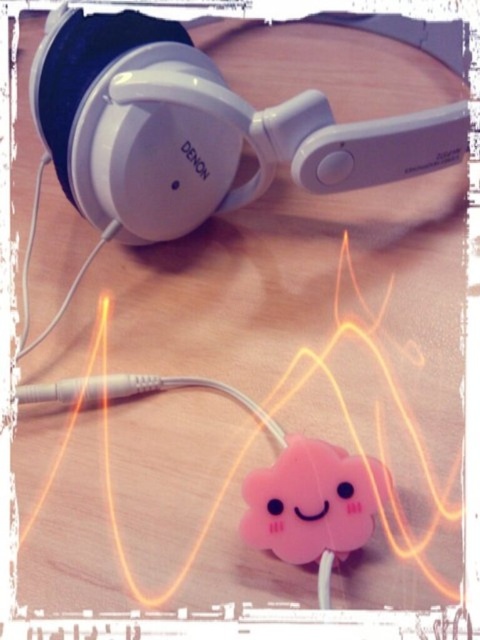
Question: Can you confirm if white matte headphones at upper center is thinner than pink matte cloud at center?

Choices:
 (A) no
 (B) yes

Answer: (A)

Question: Which of the following is the farthest from the observer?

Choices:
 (A) white matte headphones at upper center
 (B) pink matte cloud at center

Answer: (A)

Question: Can you confirm if white matte headphones at upper center is positioned to the left of pink matte cloud at center?

Choices:
 (A) no
 (B) yes

Answer: (B)

Question: Which object is closer to the camera taking this photo?

Choices:
 (A) white matte headphones at upper center
 (B) pink matte cloud at center

Answer: (B)

Question: Is white matte headphones at upper center wider than pink matte cloud at center?

Choices:
 (A) no
 (B) yes

Answer: (B)